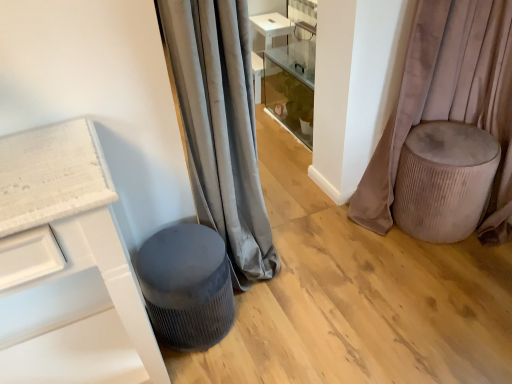
Question: From the image's perspective, is velvet beige ottoman at right located above or below velvet grey stool at lower left?

Choices:
 (A) above
 (B) below

Answer: (A)

Question: Is velvet beige ottoman at right situated inside velvet grey stool at lower left or outside?

Choices:
 (A) outside
 (B) inside

Answer: (A)

Question: Estimate the real-world distances between objects in this image. Which object is farther from the velvet grey stool at lower left?

Choices:
 (A) velvet beige ottoman at right
 (B) gray velvet curtain at center, the 2th curtain when ordered from right to left
 (C) velvet beige stool at right, the 2th curtain positioned from the left

Answer: (C)

Question: Estimate the real-world distances between objects in this image. Which object is farther from the gray velvet curtain at center, which is the 1th curtain from left to right?

Choices:
 (A) velvet grey stool at lower left
 (B) velvet beige ottoman at right
 (C) velvet beige stool at right, the first curtain positioned from the right

Answer: (C)